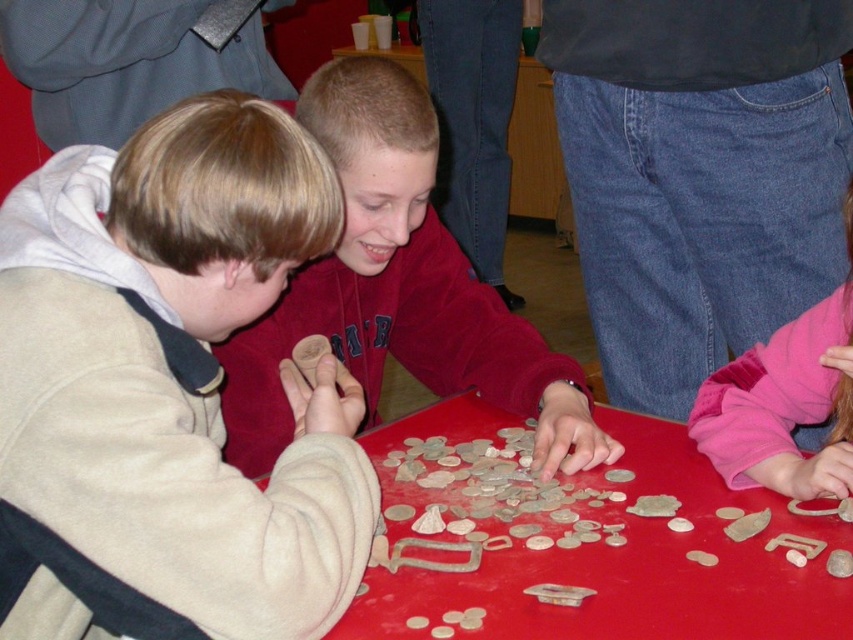
Question: Does smooth red sweater at center appear under metallic coins at center?

Choices:
 (A) yes
 (B) no

Answer: (B)

Question: Which point is farther to the camera?

Choices:
 (A) pink fleece sleeve at lower right
 (B) beige fleece jacket at left

Answer: (A)

Question: Can you confirm if beige fleece jacket at left is thinner than smooth red sweater at center?

Choices:
 (A) no
 (B) yes

Answer: (B)

Question: Which of the following is the farthest from the observer?

Choices:
 (A) beige fleece jacket at left
 (B) pink fleece sleeve at lower right
 (C) smooth red sweater at center

Answer: (C)

Question: Based on their relative distances, which object is nearer to the beige fleece jacket at left?

Choices:
 (A) smooth red sweater at center
 (B) metallic coins at center

Answer: (A)

Question: Can you confirm if beige fleece jacket at left is thinner than smooth red sweater at center?

Choices:
 (A) no
 (B) yes

Answer: (B)